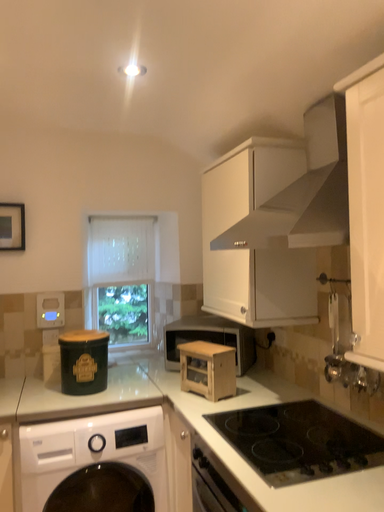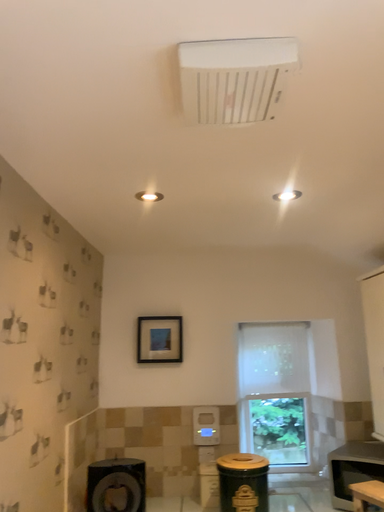
Question: Which way did the camera rotate in the video?

Choices:
 (A) rotated downward
 (B) rotated upward

Answer: (B)